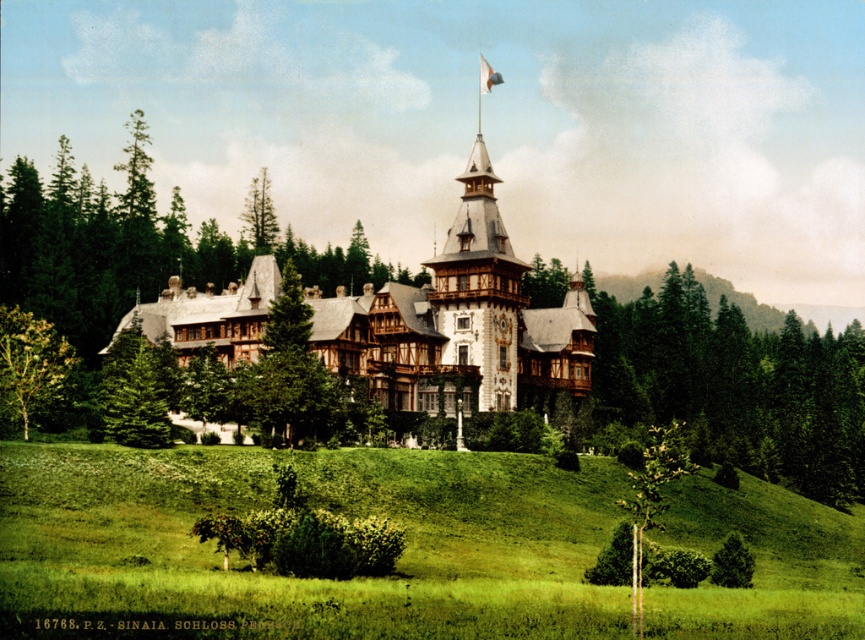
Question: Which point is closer to the camera?

Choices:
 (A) (283, 330)
 (B) (754, 403)

Answer: (A)

Question: In this image, where is green wood at center located relative to green wood tree at center?

Choices:
 (A) below
 (B) above

Answer: (A)

Question: Can you confirm if wooden timber castle at center is positioned above green wood at center?

Choices:
 (A) yes
 (B) no

Answer: (A)

Question: Which object appears farthest from the camera in this image?

Choices:
 (A) green leafy tree at lower left
 (B) wooden timber castle at center
 (C) green grassy hillside at center

Answer: (B)

Question: Can you confirm if green leafy tree at lower left is positioned below green textured pine tree at center?

Choices:
 (A) no
 (B) yes

Answer: (B)

Question: Estimate the real-world distances between objects in this image. Which object is closer to the green leafy tree at lower left?

Choices:
 (A) white fabric flag at upper center
 (B) wooden timber castle at center

Answer: (B)